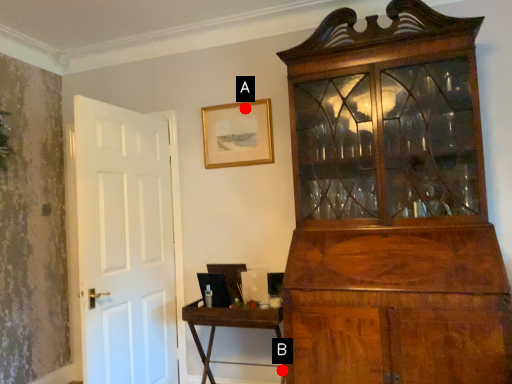
Question: Two points are circled on the image, labeled by A and B beside each circle. Which point is closer to the camera?

Choices:
 (A) A is closer
 (B) B is closer

Answer: (B)